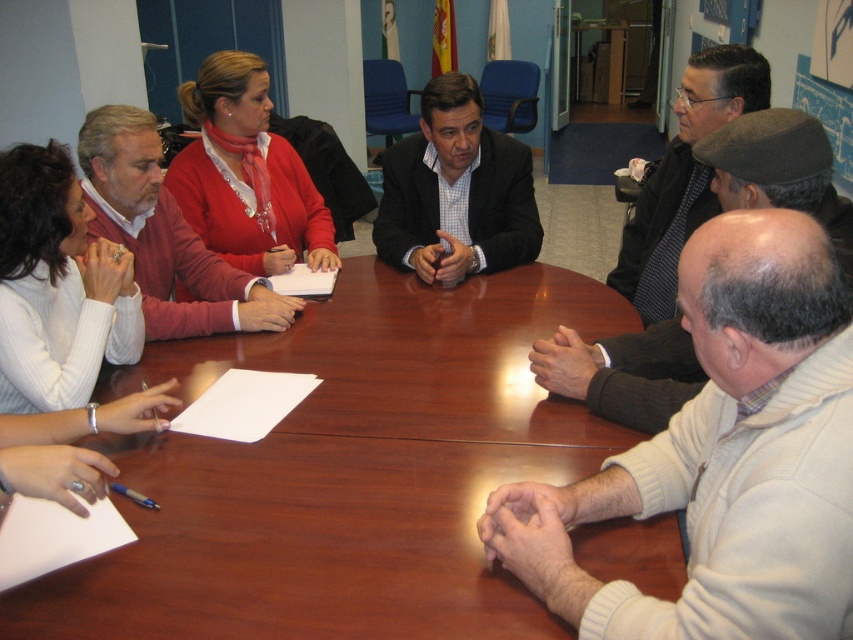
Is dark gray knit cap at upper right bigger than dark gray textured jacket at upper right?

Actually, dark gray knit cap at upper right might be smaller than dark gray textured jacket at upper right.

Between dark gray knit cap at upper right and dark gray textured jacket at upper right, which one has more height?

With more height is dark gray textured jacket at upper right.

The width and height of the screenshot is (853, 640). Describe the element at coordinates (778, 170) in the screenshot. I see `dark gray knit cap at upper right` at that location.

This screenshot has width=853, height=640. Identify the location of dark gray knit cap at upper right. pyautogui.click(x=778, y=170).

Which is behind, point (618, 460) or point (286, 305)?

The point (286, 305) is behind.

Measure the distance between white knit sweater at center and camera.

The distance of white knit sweater at center from camera is 81.42 centimeters.

Which is in front, point (544, 548) or point (155, 131)?

Point (544, 548)

This screenshot has width=853, height=640. I want to click on white knit sweater at center, so click(x=722, y=458).

The image size is (853, 640). What do you see at coordinates (778, 170) in the screenshot? I see `dark gray knit cap at upper right` at bounding box center [778, 170].

Looking at this image, who is shorter, dark gray knit cap at upper right or dark gray suit at center?

Standing shorter between the two is dark gray knit cap at upper right.

Find the location of `dark gray knit cap at upper right`. dark gray knit cap at upper right is located at coordinates (778, 170).

The height and width of the screenshot is (640, 853). Find the location of `dark gray knit cap at upper right`. dark gray knit cap at upper right is located at coordinates (778, 170).